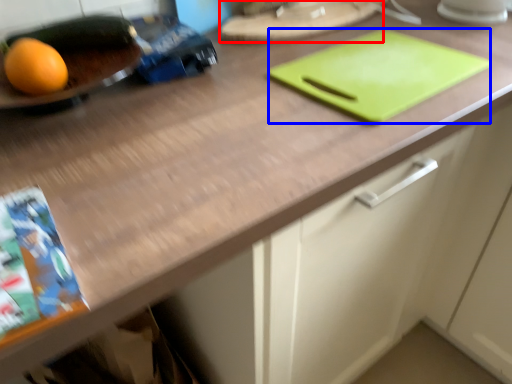
Question: Which object is further to the camera taking this photo, tray (highlighted by a red box) or tray (highlighted by a blue box)?

Choices:
 (A) tray
 (B) tray

Answer: (A)